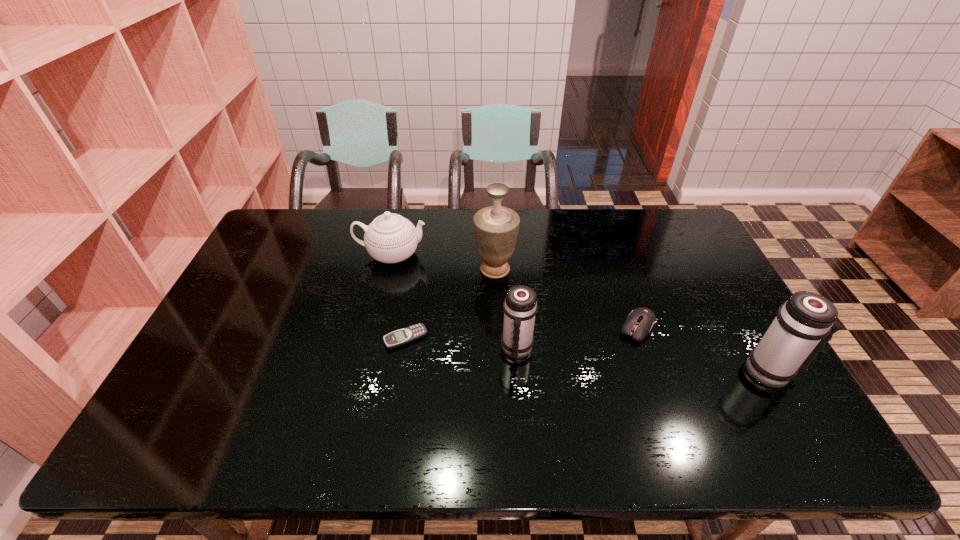
Locate an element on the screen. The height and width of the screenshot is (540, 960). free point that keeps the thermos bottles evenly spaced on the left is located at coordinates (284, 328).